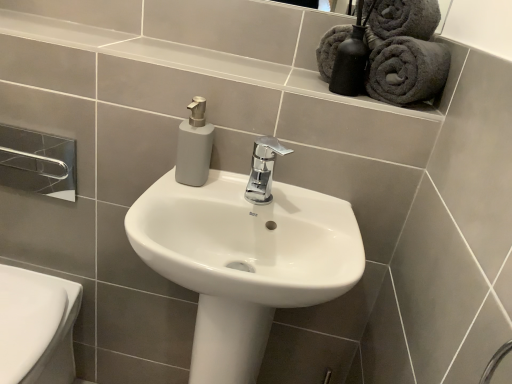
Question: From the image's perspective, relative to chrome metallic towel bar at upper left, is dark gray plush towel at upper right, which is counted as the third bath towel, starting from the left, above or below?

Choices:
 (A) above
 (B) below

Answer: (A)

Question: Is dark gray plush towel at upper right, which ranks as the 1th bath towel in right-to-left order, spatially inside chrome metallic towel bar at upper left, or outside of it?

Choices:
 (A) inside
 (B) outside

Answer: (B)

Question: Which object is positioned farthest from the white glossy sink at center?

Choices:
 (A) chrome metallic faucet at center
 (B) gray matte tile at lower right
 (C) gray plush towels at upper right, marked as the third bath towel in a right-to-left arrangement
 (D) dark grey plush bath towel at upper right, the 2th bath towel positioned from the left
 (E) dark gray plush towel at upper right, which ranks as the 1th bath towel in right-to-left order

Answer: (E)

Question: Which object is the closest to the white glossy bidet at lower left?

Choices:
 (A) dark grey plush bath towel at upper right, the 2th bath towel positioned from the left
 (B) gray matte tile at lower right
 (C) chrome metallic towel bar at upper left
 (D) chrome metallic faucet at center
 (E) dark gray plush towel at upper right, which ranks as the 1th bath towel in right-to-left order

Answer: (C)